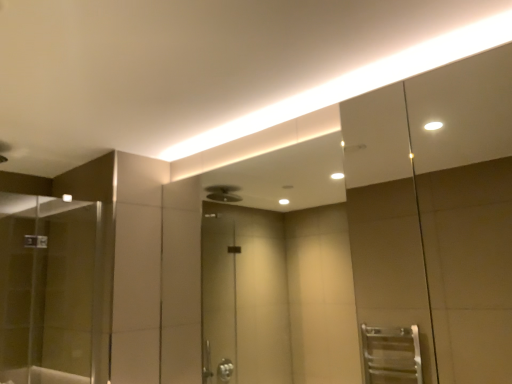
Locate an element on the screen. The image size is (512, 384). white glossy strip at upper center is located at coordinates (357, 82).

In order to face white glossy strip at upper center, should I rotate leftwards or rightwards?

It's best to rotate left around 16.638 degrees.

Describe the element at coordinates (357, 82) in the screenshot. I see `white glossy strip at upper center` at that location.

I want to click on white glossy strip at upper center, so click(x=357, y=82).